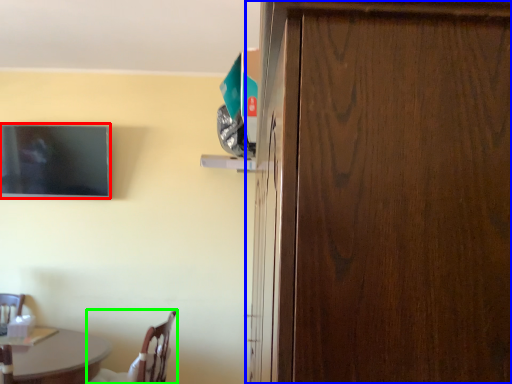
Question: Which object is positioned farthest from television (highlighted by a red box)? Select from door (highlighted by a blue box) and chair (highlighted by a green box).

Choices:
 (A) door
 (B) chair

Answer: (A)